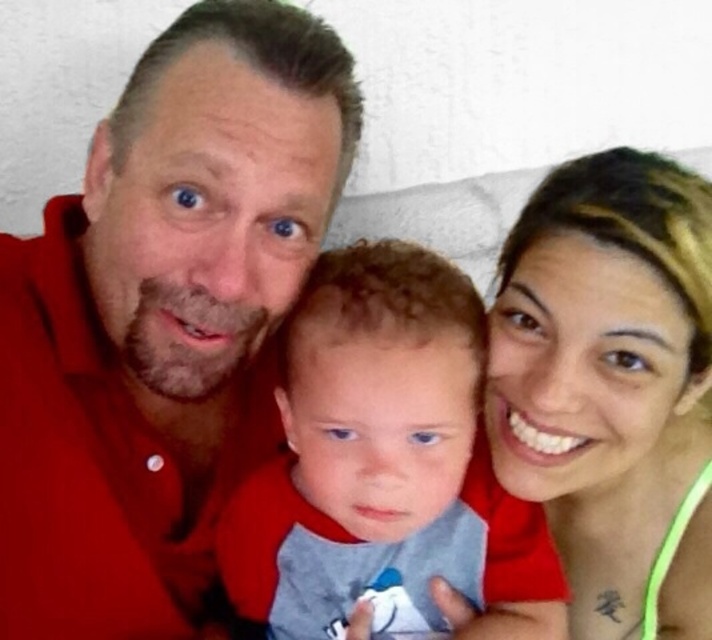
You are holding a measuring tape and need to determine the distance between the point at coordinates (164, 147) and the camera. According to the scene description, what is this distance?

The distance between the point at coordinates (164, 147) and the camera is 26.85 inches.

You are a photographer adjusting the focus on your camera. The camera has a grid overlay with coordinates from 0 to 1 on both axes. You need to ensure that the smooth skin face at upper right is centered in the frame. According to the coordinates provided, where should you position the center of the camera frame?

The smooth skin face at upper right is located at point (604, 368), so you should position the center of the camera frame at those coordinates to center it.